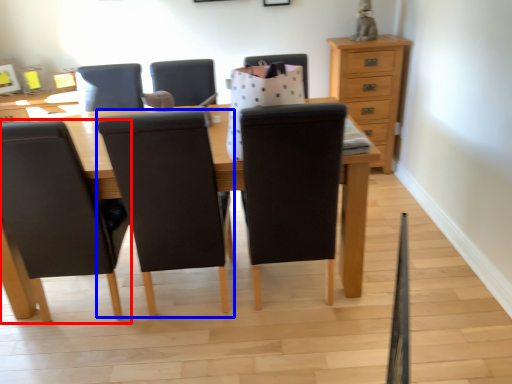
Question: Which of the following is the farthest to the observer, chair (highlighted by a red box) or chair (highlighted by a blue box)?

Choices:
 (A) chair
 (B) chair

Answer: (A)